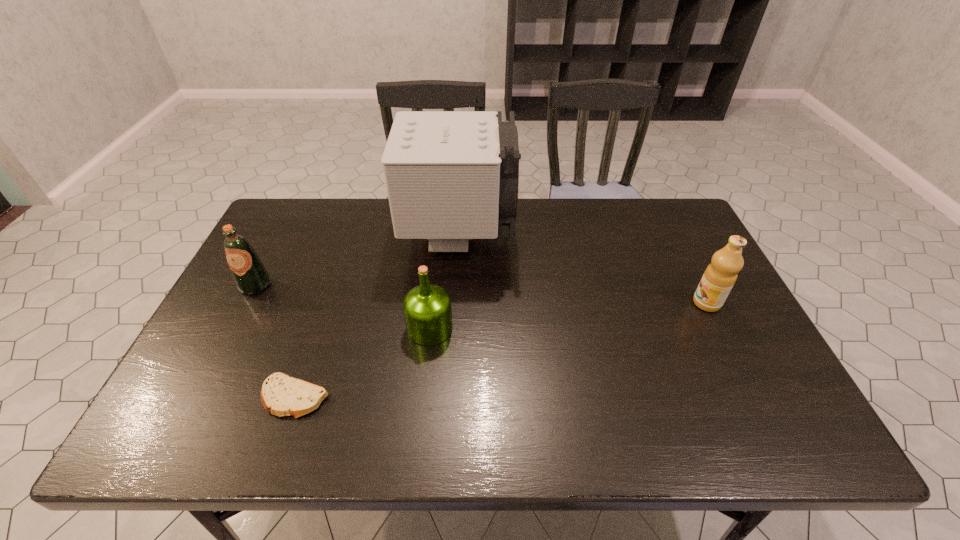
Locate an element on the screen. The image size is (960, 540). blank space at the left edge is located at coordinates (293, 268).

Where is `vacant space at the right edge of the desktop`? The height and width of the screenshot is (540, 960). vacant space at the right edge of the desktop is located at coordinates (682, 276).

This screenshot has height=540, width=960. What are the coordinates of `vacant space at the far left corner` in the screenshot? It's located at (282, 236).

In order to click on vacant region at the near left corner in this screenshot , I will do `click(235, 418)`.

Find the location of a particular element. The width and height of the screenshot is (960, 540). free space between the nearest object and the rightmost olive oil is located at coordinates point(501,350).

The height and width of the screenshot is (540, 960). In order to click on vacant space in between the leftmost olive oil and the pita bread in this screenshot , I will do [x=276, y=341].

Where is `vacant point located between the rightmost object and the second object from left to right`? vacant point located between the rightmost object and the second object from left to right is located at coordinates (501, 350).

Locate an element on the screen. The height and width of the screenshot is (540, 960). free space between the rightmost object and the second olive oil from left to right is located at coordinates (568, 315).

Where is `unoccupied position between the second object from left to right and the second olive oil from right to left`? The width and height of the screenshot is (960, 540). unoccupied position between the second object from left to right and the second olive oil from right to left is located at coordinates (362, 362).

Locate an element on the screen. free space between the second olive oil from left to right and the tallest object is located at coordinates (444, 282).